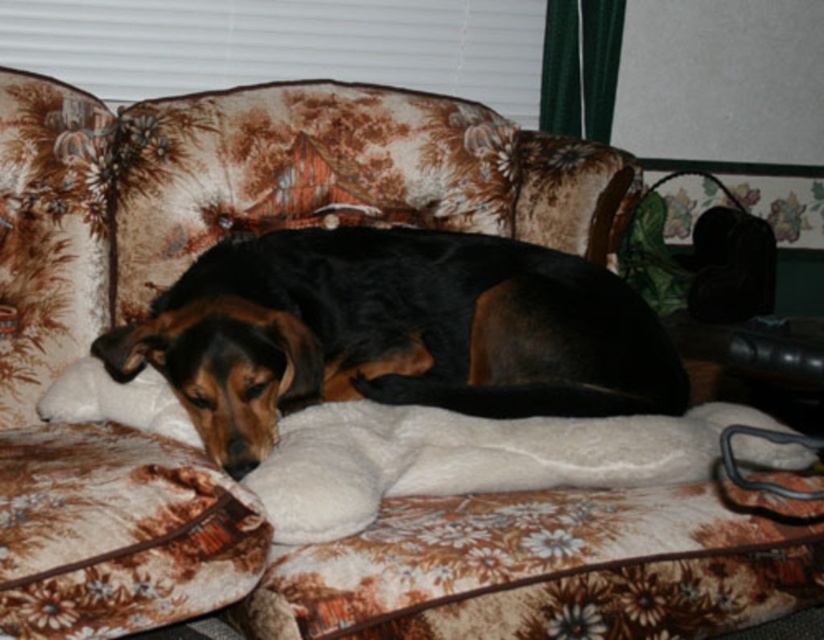
Who is more distant from viewer, (152, 451) or (357, 284)?

The point (357, 284) is more distant.

Which is more to the left, floral fabric couch at center or black fur dog at center?

floral fabric couch at center

Who is more distant from viewer, (113, 490) or (279, 259)?

The point (279, 259) is more distant.

Locate an element on the screen. floral fabric couch at center is located at coordinates (181, 269).